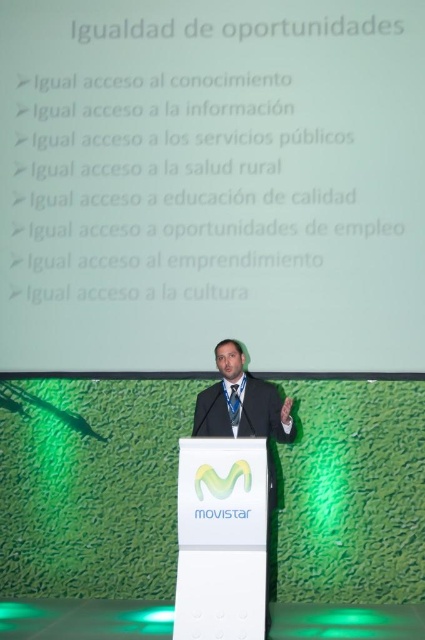
You are an event planner organizing a formal event. You need to ensure that the attire of the presenter matches the formal setting. Considering the black fabric business suit at center and the blue satin tie at center, which item would you adjust if you want to make them more proportional to each other?

The black fabric business suit at center is bigger than the blue satin tie at center. To make them more proportional, you could either reduce the size of the suit or increase the size of the tie.